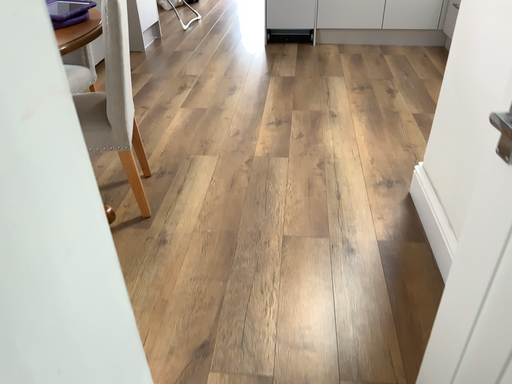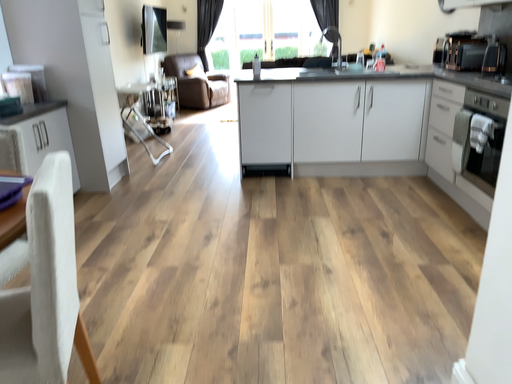
Question: Which way did the camera rotate in the video?

Choices:
 (A) rotated downward
 (B) rotated upward

Answer: (B)